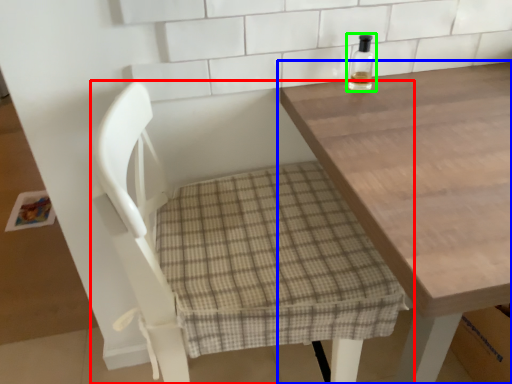
Question: Considering the real-world distances, which object is farthest from chair (highlighted by a red box)? table (highlighted by a blue box) or bottle (highlighted by a green box)?

Choices:
 (A) table
 (B) bottle

Answer: (B)